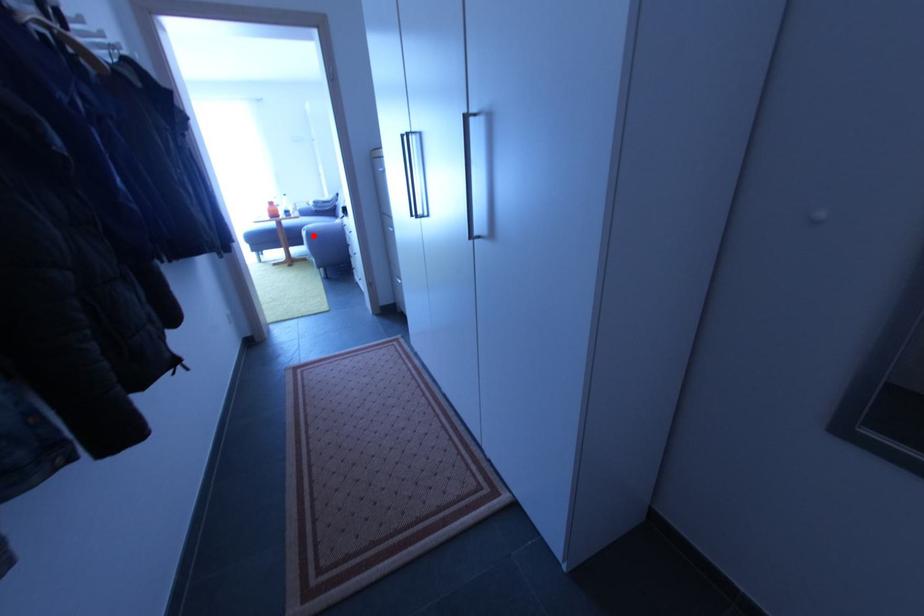
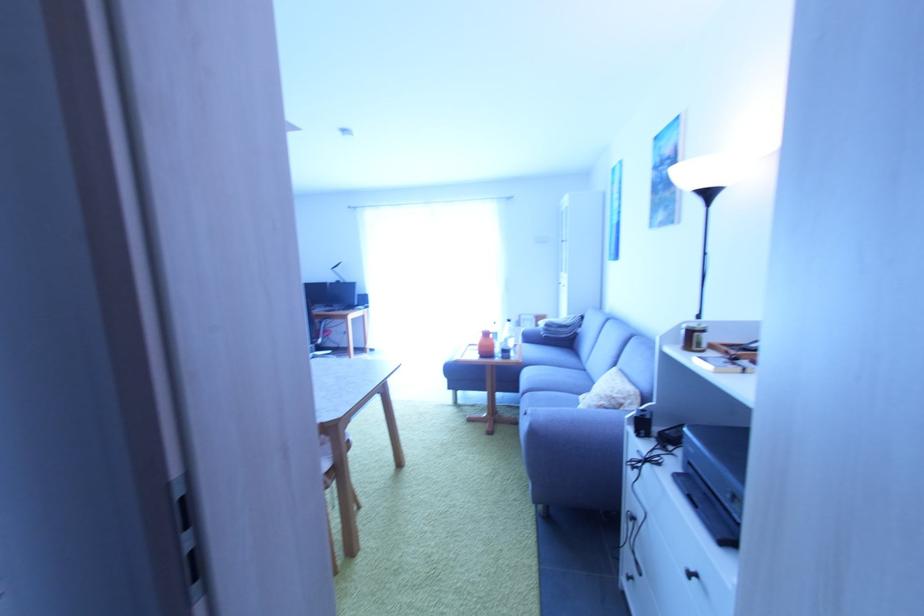
In the second image, find the point that corresponds to the highlighted location in the first image.

(538, 435)